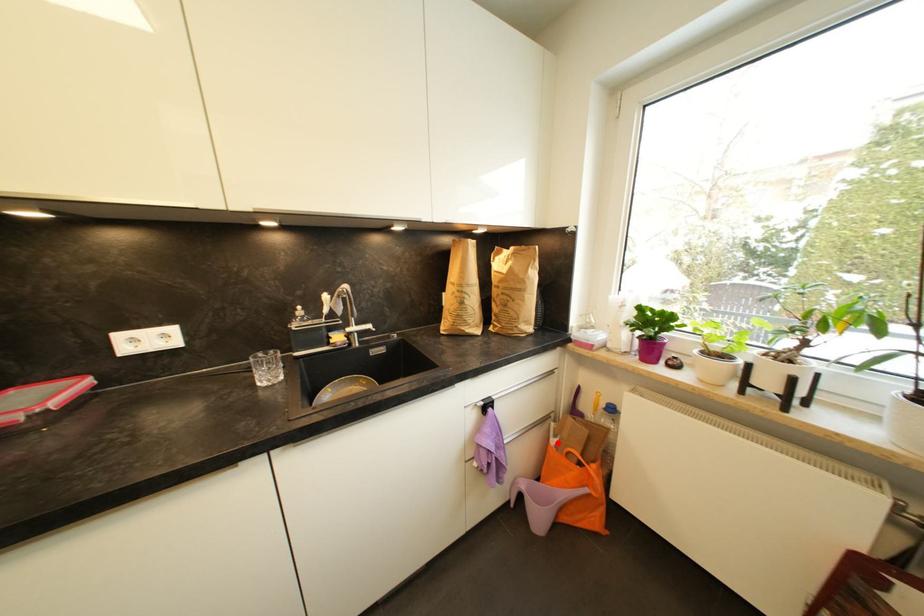
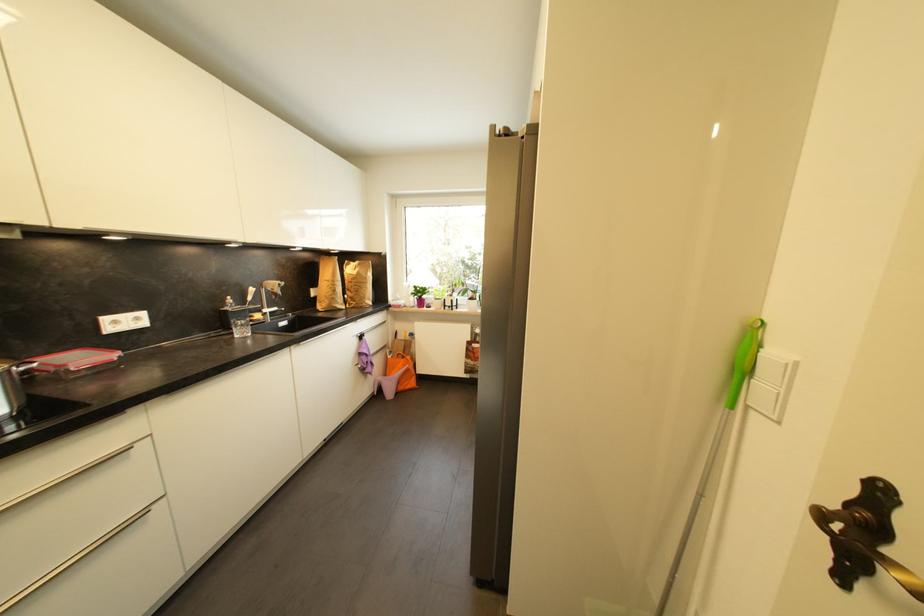
Question: A red point is marked in image1. In image2, is the corresponding 3D point closer to the camera or farther? Reply with the corresponding letter.

Choices:
 (A) The corresponding 3D point is closer.
 (B) The corresponding 3D point is farther.

Answer: (B)